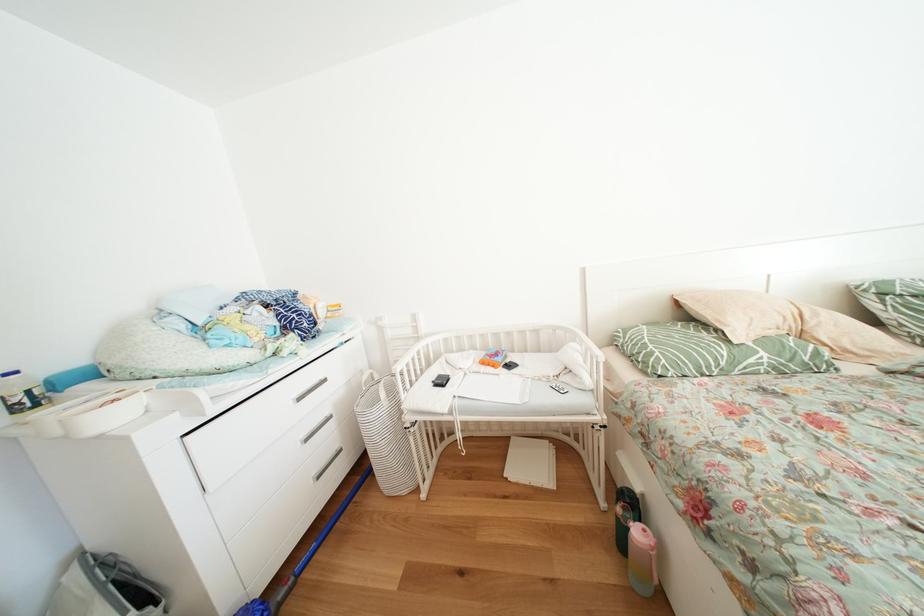
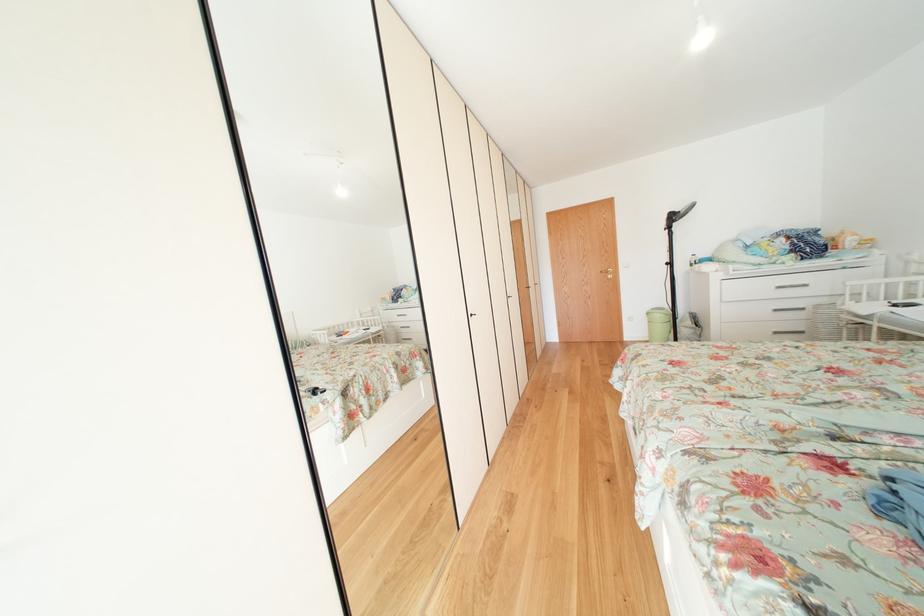
In the second image, find the point that corresponds to (x=317, y=445) in the first image.

(784, 315)